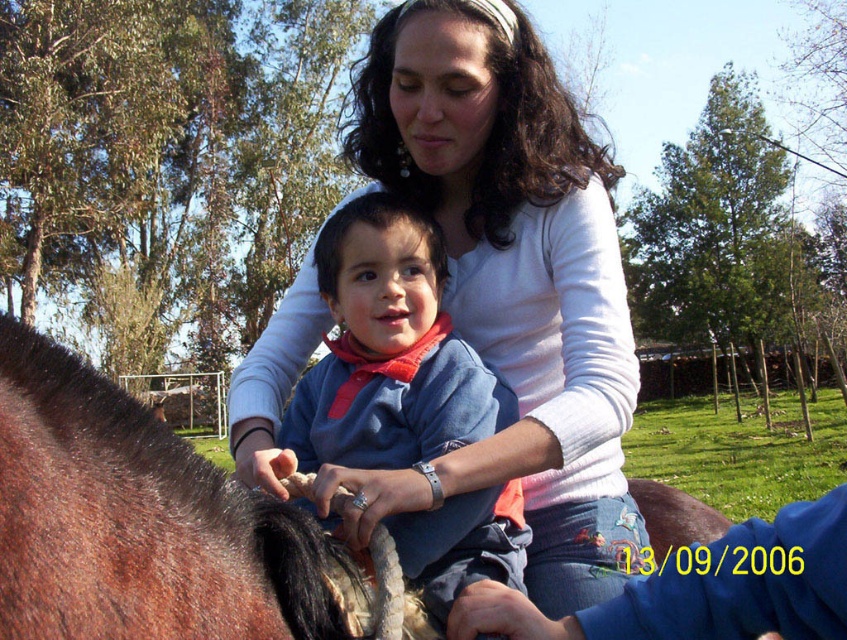
Question: Can you confirm if white matte shirt at center is thinner than brown fuzzy horse at left?

Choices:
 (A) yes
 (B) no

Answer: (B)

Question: Is brown fuzzy horse at left below blue cotton shirt at center?

Choices:
 (A) yes
 (B) no

Answer: (A)

Question: Which object appears closest to the camera in this image?

Choices:
 (A) brown fuzzy horse at left
 (B) white matte shirt at center
 (C) blue cotton shirt at center

Answer: (A)

Question: Which of these objects is positioned closest to the white matte shirt at center?

Choices:
 (A) brown fuzzy horse at left
 (B) blue cotton shirt at center

Answer: (B)

Question: In this image, where is white matte shirt at center located relative to brown fuzzy horse at left?

Choices:
 (A) below
 (B) above

Answer: (B)

Question: Which object is positioned farthest from the white matte shirt at center?

Choices:
 (A) blue cotton shirt at center
 (B) brown fuzzy horse at left

Answer: (B)